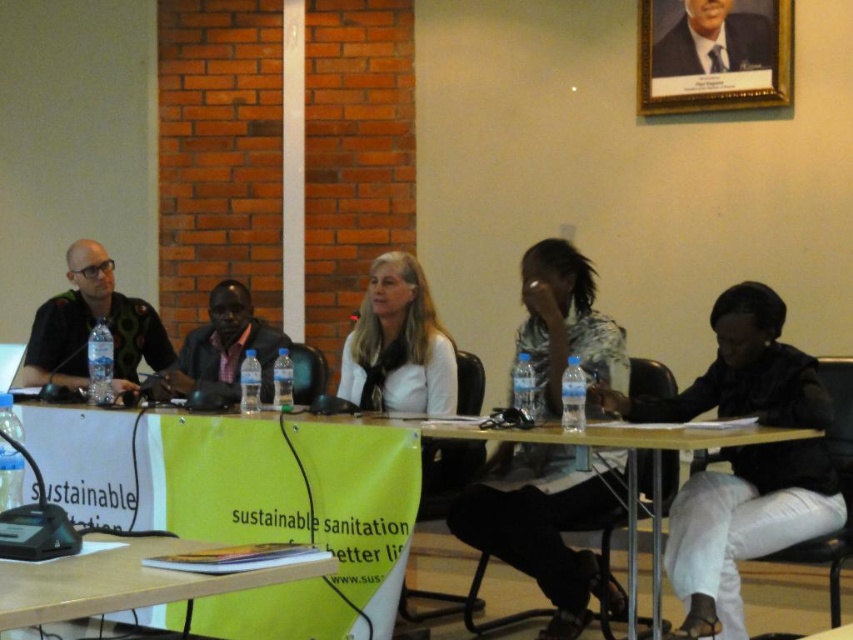
Question: Which of the following is the farthest from the observer?

Choices:
 (A) (448, 424)
 (B) (241, 353)
 (C) (120, 570)

Answer: (B)

Question: Considering the real-world distances, which object is farthest from the green fabric banner at center?

Choices:
 (A) wooden table at center
 (B) wooden framed portrait at upper right

Answer: (B)

Question: Is green fabric banner at center positioned behind wooden framed portrait at upper right?

Choices:
 (A) yes
 (B) no

Answer: (B)

Question: Which object is closer to the camera taking this photo?

Choices:
 (A) green fabric banner at center
 (B) wooden framed portrait at upper right
 (C) patterned fabric shirt at center
 (D) matte black shirt at center

Answer: (C)

Question: Can you confirm if matte black shirt at left is positioned to the left of wooden table at lower right?

Choices:
 (A) yes
 (B) no

Answer: (A)

Question: Does patterned fabric shirt at center come behind wooden framed portrait at upper right?

Choices:
 (A) no
 (B) yes

Answer: (A)